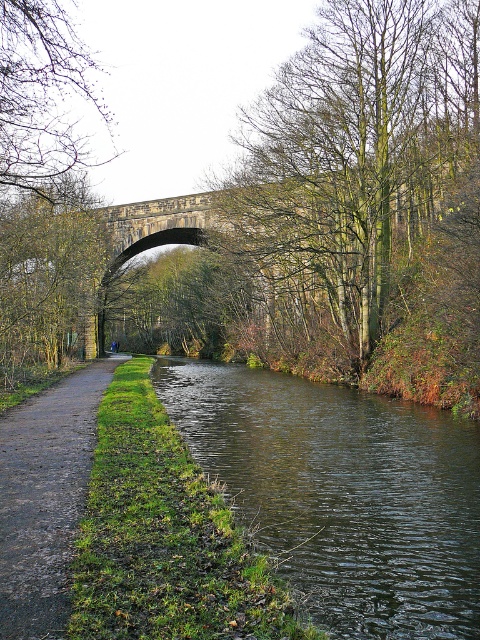
From the picture: Between green leafy tree at center and bare branches at upper left, which one appears on the right side from the viewer's perspective?

Positioned to the right is green leafy tree at center.

Does green leafy tree at center appear on the left side of bare branches at upper left?

In fact, green leafy tree at center is to the right of bare branches at upper left.

The width and height of the screenshot is (480, 640). I want to click on green leafy tree at center, so click(361, 186).

Which is behind, point (15, 497) or point (22, 26)?

Point (22, 26)

Locate an element on the screen. dull brown dirt path at lower left is located at coordinates (46, 497).

Looking at this image, does dark green water at lower center have a greater width compared to bare branches at upper left?

In fact, dark green water at lower center might be narrower than bare branches at upper left.

What do you see at coordinates (343, 493) in the screenshot? This screenshot has width=480, height=640. I see `dark green water at lower center` at bounding box center [343, 493].

Does point (326, 442) come closer to viewer compared to point (84, 90)?

Yes, it is.

The image size is (480, 640). Identify the location of dark green water at lower center. (343, 493).